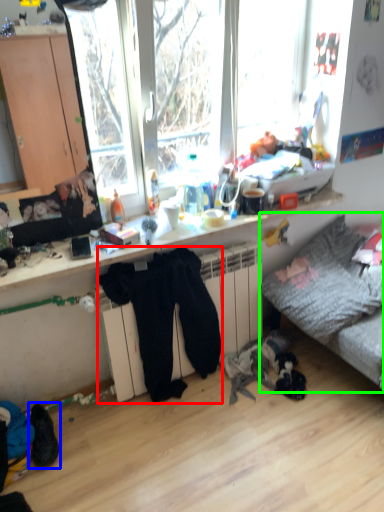
Question: Based on their relative distances, which object is farther from clothing (highlighted by a red box)? Choose from footwear (highlighted by a blue box) and studio couch (highlighted by a green box).

Choices:
 (A) footwear
 (B) studio couch

Answer: (A)